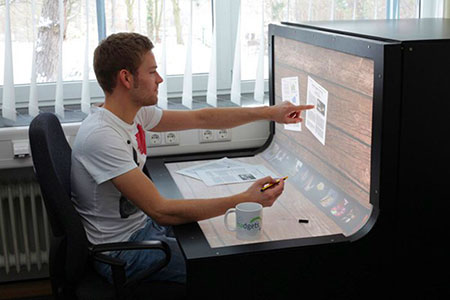
You are a GUI agent. You are given a task and a screenshot of the screen. Output one action in this format:
    pyautogui.click(x=<x>, y=<y>)
    Task: Click on the wall outlet
    This screenshot has width=450, height=300.
    Given the screenshot: What is the action you would take?
    pyautogui.click(x=224, y=132), pyautogui.click(x=207, y=134)